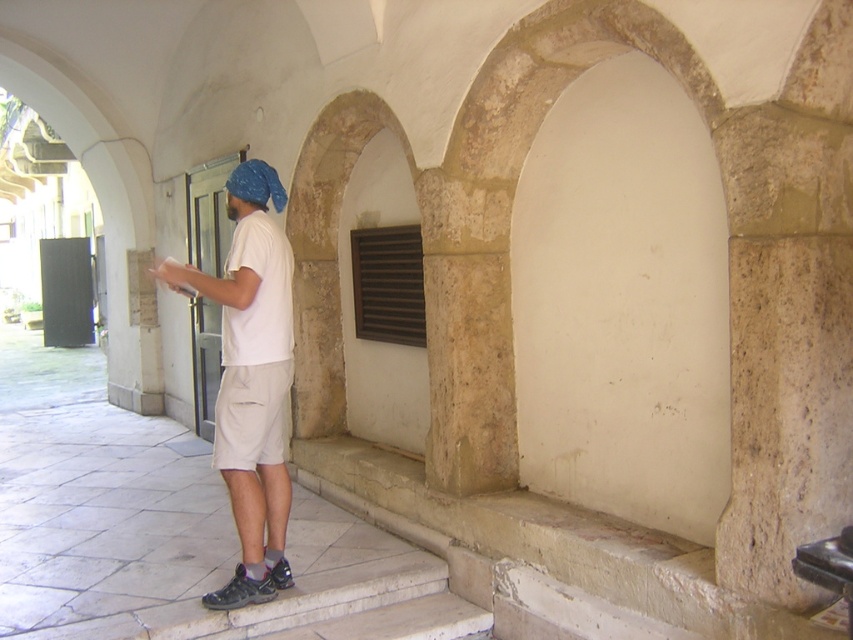
You are a photographer trying to capture a clear shot of the person in the scene. Since you want both the white cotton shirt at center and the white matte shirt at center to be in focus, how far apart are they from each other?

The white cotton shirt at center and the white matte shirt at center are 18.17 centimeters apart.

You are an architect analyzing the layout of the archway structure. You need to place a decorative sculpture exactly at the center of the walkway. The white matte shirt at center is currently at point 0.461, 0.305. Is the sculpture placement at the true center of the walkway possible without overlapping the shirt?

The white matte shirt at center is located at point (259, 294), so placing the sculpture exactly at the true center of the walkway would require checking if the shirt is already occupying that central point. Since the shirt is at (259, 294), the sculpture can be placed at the true center only if that coordinate is not the exact center. If the walkway center is different, then it can be placed without overlapping.

You are a photographer trying to capture a clear shot of the person in the scene. Since both the white cotton shirt at center and the white matte shirt at center are in the frame, which one would be easier to focus on due to its texture?

The white cotton shirt at center is in front of the white matte shirt at center, so it would be easier to focus on the white cotton shirt at center as it is closer to the camera.